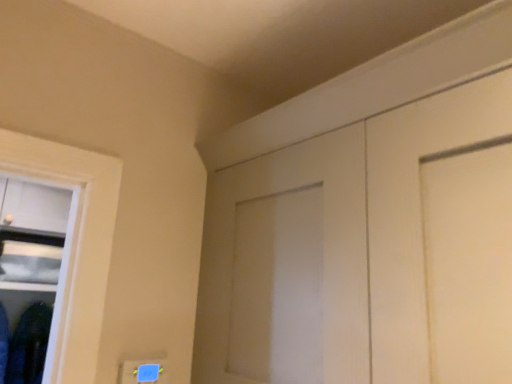
Question: Is dark blue fabric at lower left bigger or smaller than white matte door at upper right?

Choices:
 (A) big
 (B) small

Answer: (B)

Question: From the image's perspective, relative to white matte door at upper right, is dark blue fabric at lower left above or below?

Choices:
 (A) below
 (B) above

Answer: (A)

Question: From a real-world perspective, is dark blue fabric at lower left above or below white matte door at upper right?

Choices:
 (A) above
 (B) below

Answer: (B)

Question: Relative to dark blue fabric at lower left, is white matte door at upper right in front or behind?

Choices:
 (A) behind
 (B) front

Answer: (B)

Question: Considering the positions of white matte door at upper right and dark blue fabric at lower left in the image, is white matte door at upper right wider or thinner than dark blue fabric at lower left?

Choices:
 (A) wide
 (B) thin

Answer: (A)

Question: From a real-world perspective, is white matte door at upper right above or below dark blue fabric at lower left?

Choices:
 (A) below
 (B) above

Answer: (B)

Question: Is white matte door at upper right inside or outside of dark blue fabric at lower left?

Choices:
 (A) inside
 (B) outside

Answer: (B)